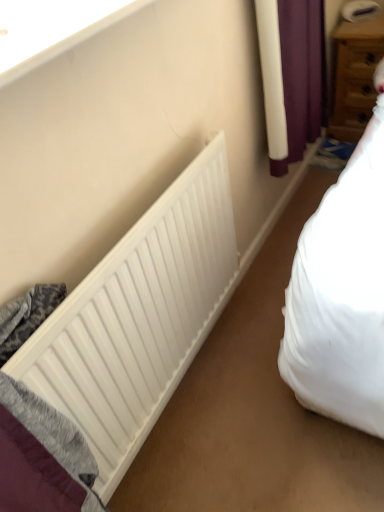
At what (x,y) coordinates should I click in order to perform the action: click on vacant area on top of white matte radiator at lower left (from a real-world perspective). Please return your answer as a coordinate pair (x, y). Looking at the image, I should click on (77, 256).